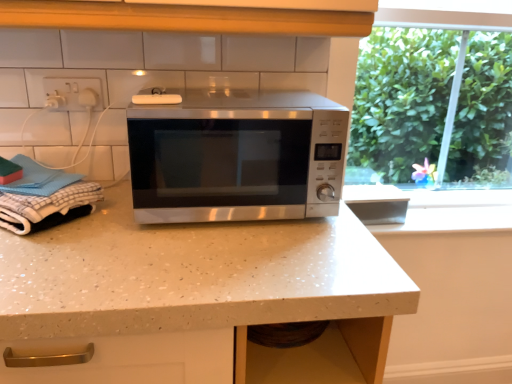
Question: Can you confirm if white plastic socket at upper left is wider than white checkered cloth at left?

Choices:
 (A) yes
 (B) no

Answer: (B)

Question: Is white plastic socket at upper left smaller than white checkered cloth at left?

Choices:
 (A) no
 (B) yes

Answer: (B)

Question: Is white checkered cloth at left a part of white plastic socket at upper left?

Choices:
 (A) no
 (B) yes

Answer: (A)

Question: Is white plastic socket at upper left oriented towards white checkered cloth at left?

Choices:
 (A) no
 (B) yes

Answer: (A)

Question: Is white plastic socket at upper left to the right of white checkered cloth at left from the viewer's perspective?

Choices:
 (A) no
 (B) yes

Answer: (B)

Question: In the image, is white speckled laminate countertop at center positioned in front of or behind white checkered cloth at left?

Choices:
 (A) front
 (B) behind

Answer: (A)

Question: Is point (160, 306) positioned closer to the camera than point (100, 188)?

Choices:
 (A) closer
 (B) farther

Answer: (A)

Question: Is white speckled laminate countertop at center situated inside white checkered cloth at left or outside?

Choices:
 (A) outside
 (B) inside

Answer: (A)

Question: Would you say white speckled laminate countertop at center is to the left or to the right of white checkered cloth at left in the picture?

Choices:
 (A) left
 (B) right

Answer: (B)

Question: Considering the positions of stainless steel microwave at center and white plastic socket at upper left in the image, is stainless steel microwave at center wider or thinner than white plastic socket at upper left?

Choices:
 (A) thin
 (B) wide

Answer: (B)

Question: Considering their positions, is stainless steel microwave at center located in front of or behind white plastic socket at upper left?

Choices:
 (A) front
 (B) behind

Answer: (A)

Question: From their relative heights in the image, would you say stainless steel microwave at center is taller or shorter than white plastic socket at upper left?

Choices:
 (A) tall
 (B) short

Answer: (A)

Question: Is stainless steel microwave at center inside or outside of white plastic socket at upper left?

Choices:
 (A) outside
 (B) inside

Answer: (A)

Question: Considering the relative positions of white checkered cloth at left and white plastic socket at upper left in the image provided, is white checkered cloth at left to the left or to the right of white plastic socket at upper left?

Choices:
 (A) right
 (B) left

Answer: (B)

Question: Which is correct: white checkered cloth at left is inside white plastic socket at upper left, or outside of it?

Choices:
 (A) inside
 (B) outside

Answer: (B)